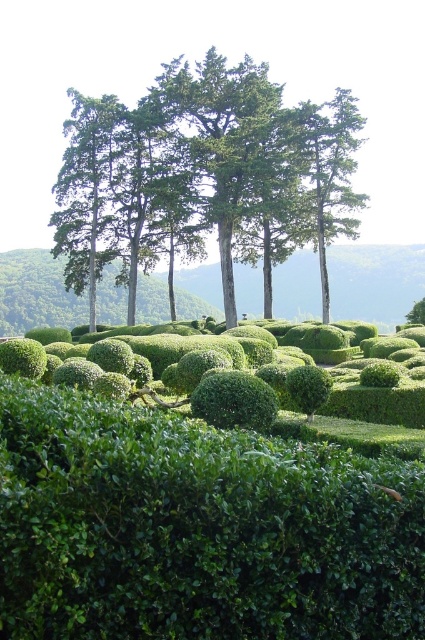
Question: Which object is closer to the camera taking this photo?

Choices:
 (A) green leafy tree at center
 (B) green leafy trees at upper center

Answer: (B)

Question: Is green leafy trees at upper center thinner than green leafy tree at center?

Choices:
 (A) yes
 (B) no

Answer: (B)

Question: Is green leafy trees at upper center wider than green leafy tree at center?

Choices:
 (A) yes
 (B) no

Answer: (A)

Question: Among these points, which one is farthest from the camera?

Choices:
 (A) (336, 92)
 (B) (227, 241)

Answer: (A)

Question: Can you confirm if green leafy trees at upper center is thinner than green leafy tree at center?

Choices:
 (A) no
 (B) yes

Answer: (A)

Question: Which of the following is the closest to the observer?

Choices:
 (A) (340, 208)
 (B) (178, 166)

Answer: (B)